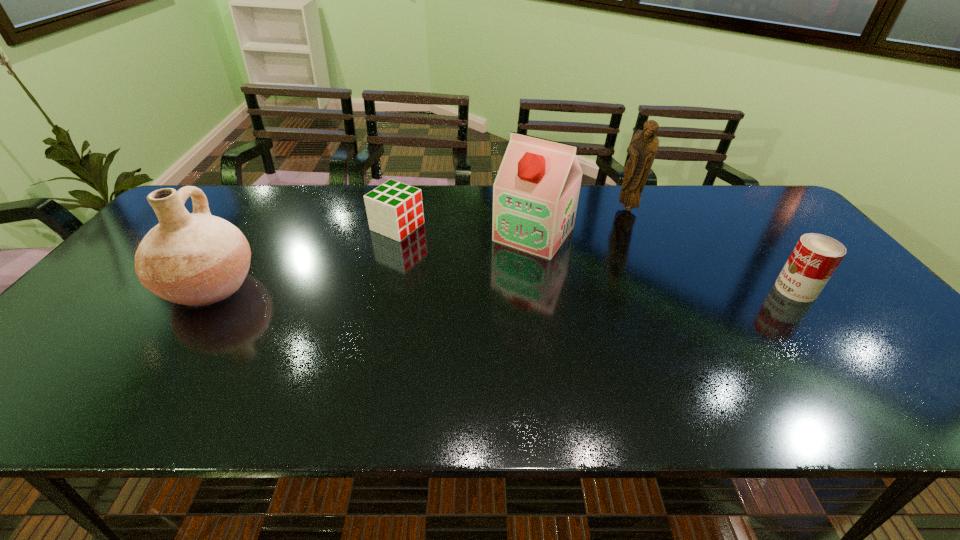
The image size is (960, 540). In order to click on vacant region located 0.180m on the front label of the fourth tallest object in this screenshot , I will do `click(708, 289)`.

At what (x,y) coordinates should I click in order to perform the action: click on free spot located on the red face of the fourth object from right to left. Please return your answer as a coordinate pair (x, y). Looking at the image, I should click on (451, 248).

What are the coordinates of `free space located 0.250m on the red face of the fourth object from right to left` in the screenshot? It's located at (490, 262).

Image resolution: width=960 pixels, height=540 pixels. I want to click on blank area located 0.080m on the red face of the fourth object from right to left, so click(x=440, y=243).

Locate an element on the screen. free location located 0.330m with the cap open on the third object from left to right is located at coordinates (453, 333).

The image size is (960, 540). I want to click on vacant space located 0.380m with the cap open on the third object from left to right, so click(441, 347).

This screenshot has width=960, height=540. I want to click on vacant space located with the cap open on the third object from left to right, so click(488, 290).

Locate an element on the screen. vacant space located 0.320m on the front-facing side of the figurine is located at coordinates (560, 258).

This screenshot has width=960, height=540. Identify the location of vacant point located on the front-facing side of the figurine. (588, 239).

Locate an element on the screen. This screenshot has width=960, height=540. free spot located on the front-facing side of the figurine is located at coordinates (588, 239).